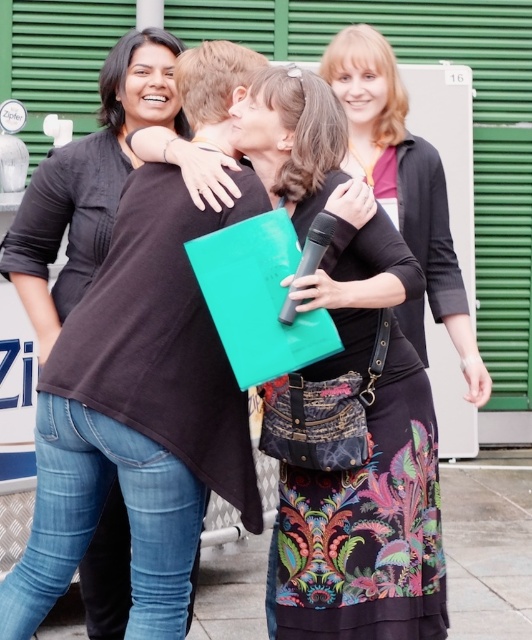
Question: Considering the real-world distances, which object is closest to the floral-patterned fabric dress at center?

Choices:
 (A) smooth concrete pavement at lower center
 (B) matte green folder at center

Answer: (B)

Question: Is black matte shirt at left above black plastic microphone at center?

Choices:
 (A) no
 (B) yes

Answer: (B)

Question: Which object is positioned farthest from the floral-patterned fabric dress at center?

Choices:
 (A) black plastic microphone at center
 (B) black matte shirt at left

Answer: (B)

Question: Which point is closer to the camera taking this photo?

Choices:
 (A) (334, 218)
 (B) (85, 216)
 (C) (527, 561)
 (D) (350, 429)

Answer: (A)

Question: Is smooth concrete pavement at lower center smaller than floral-patterned fabric dress at center?

Choices:
 (A) yes
 (B) no

Answer: (B)

Question: Does floral-patterned fabric dress at center have a smaller size compared to black plastic microphone at center?

Choices:
 (A) no
 (B) yes

Answer: (A)